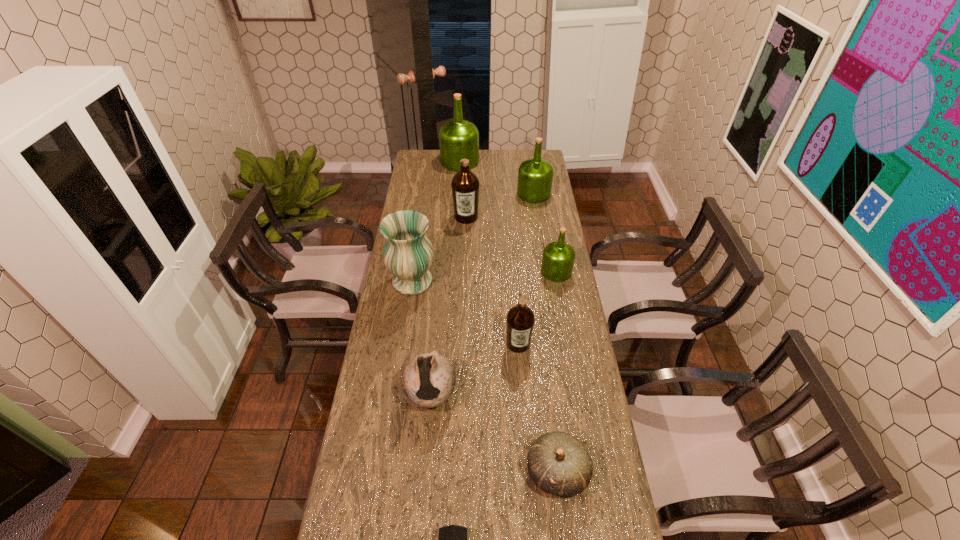
Identify the location of vacant area situated 0.190m from the spout of the seventh farthest object. The image size is (960, 540). (423, 484).

Identify the location of free space located 0.340m on the left of the gourd. (406, 472).

I want to click on object that is at the far edge, so click(x=458, y=139).

This screenshot has width=960, height=540. Find the location of `olive oil positioned at the left edge`. olive oil positioned at the left edge is located at coordinates (458, 139).

I want to click on vase at the left edge, so click(408, 254).

I want to click on pottery positioned at the left edge, so click(x=428, y=380).

This screenshot has width=960, height=540. In order to click on gourd that is positioned at the right edge in this screenshot , I will do `click(558, 463)`.

Where is `object present at the far left corner`? This screenshot has width=960, height=540. object present at the far left corner is located at coordinates (458, 139).

Find the location of `vacant space at the left edge`. vacant space at the left edge is located at coordinates (415, 320).

In the image, there is a desktop. Identify the location of vacant space at the right edge. (559, 328).